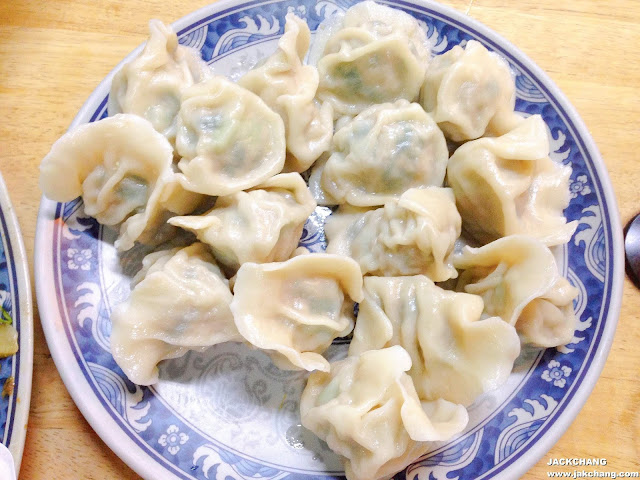
Find the location of a particular element. This screenshot has width=640, height=480. light glare is located at coordinates (212, 432), (112, 283).